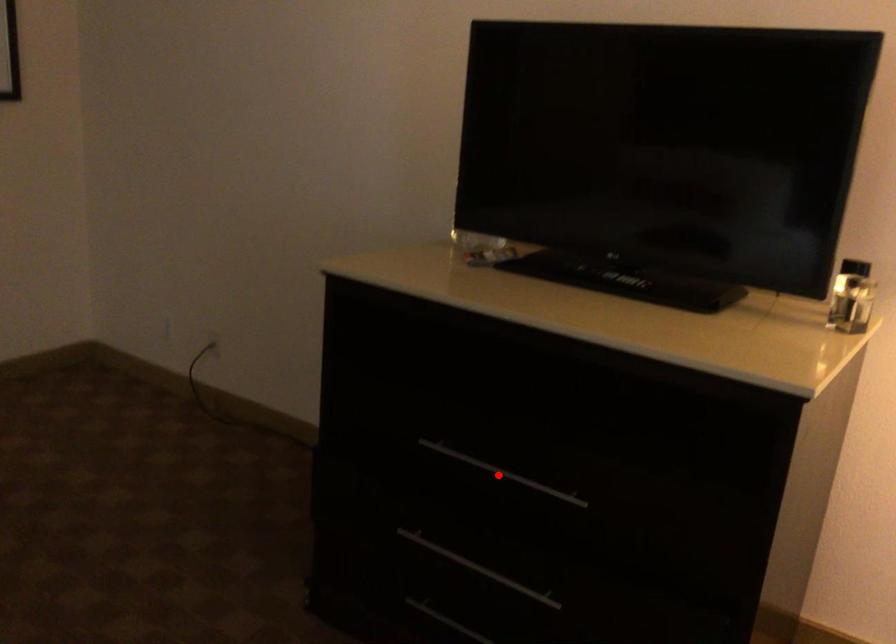
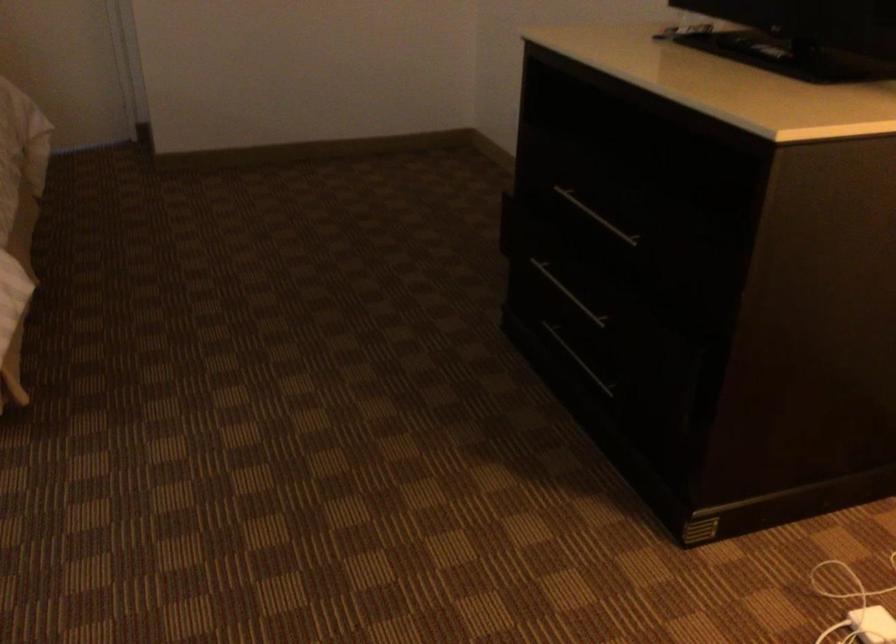
Locate, in the second image, the point that corresponds to the highlighted location in the first image.

(596, 216)